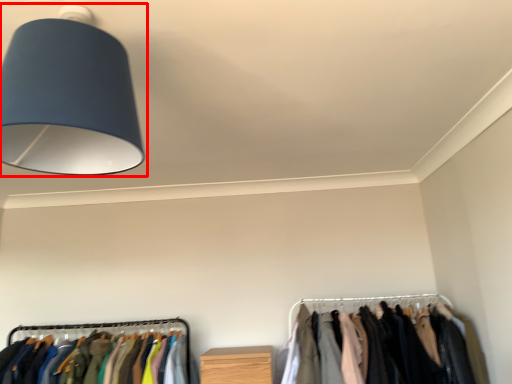
Question: Observing the image, what is the correct spatial positioning of lamp (annotated by the red box) in reference to closet?

Choices:
 (A) right
 (B) left

Answer: (B)